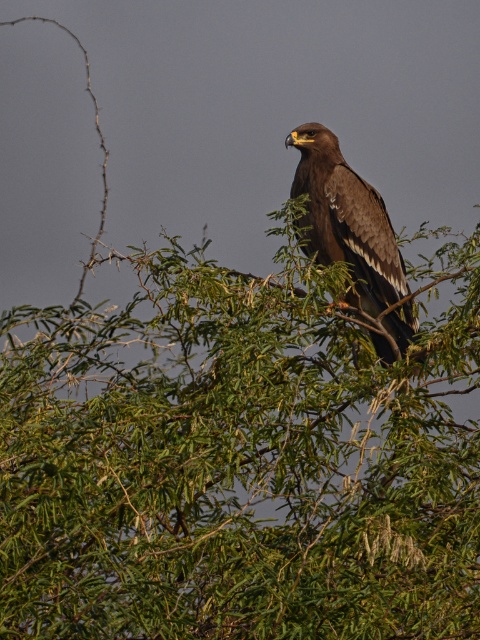
You are a birdwatcher trying to determine if the brown feathered eagle at center can spread its wings fully without touching the green leafy tree at upper center. Based on their widths, can the eagle do this?

The green leafy tree at upper center might be wider than the brown feathered eagle at center, so the eagle might not have enough space to spread its wings fully without touching the tree.